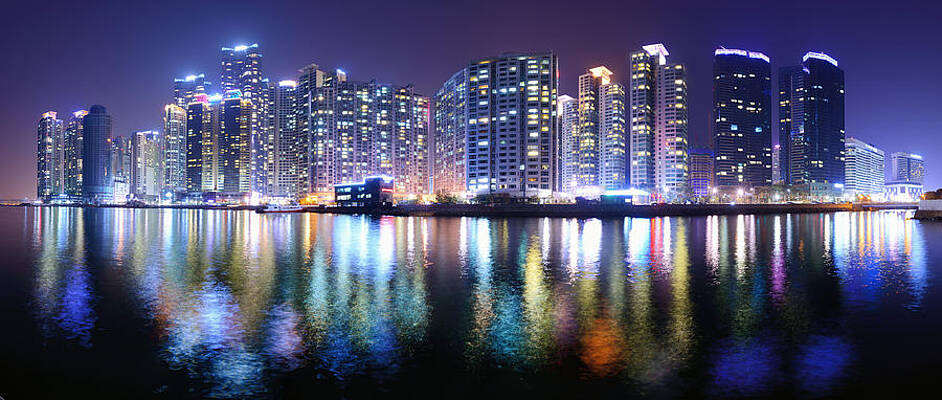
Where is `yellow lights`? yellow lights is located at coordinates [655, 366], [681, 281], [643, 307], [621, 300], [582, 299], [537, 301], [252, 272].